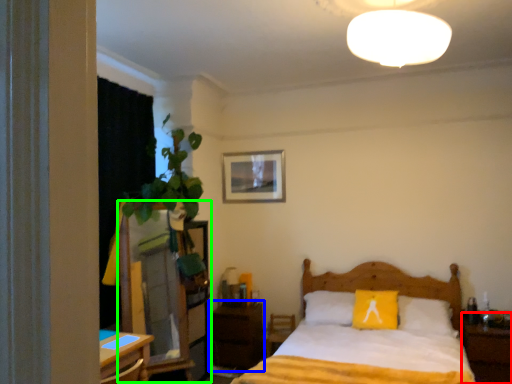
Question: Based on their relative distances, which object is farther from nightstand (highlighted by a red box)? Choose from nightstand (highlighted by a blue box) and dresser (highlighted by a green box).

Choices:
 (A) nightstand
 (B) dresser

Answer: (B)